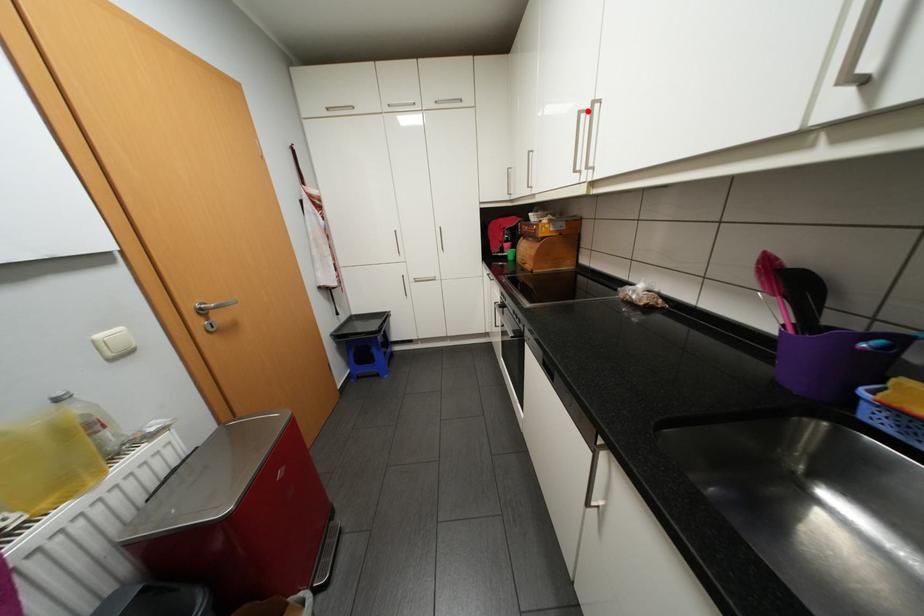
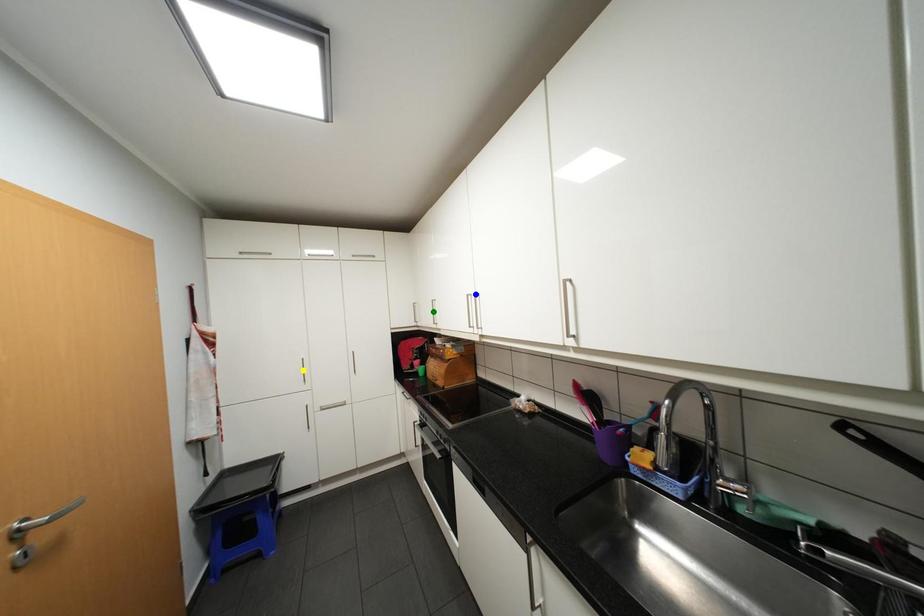
Question: I am providing you with two images of the same scene from different viewpoints. A red point is marked on the first image. You are given multiple points on the second image. Which point in image 2 is actually the same real-world point as the red point in image 1?

Choices:
 (A) yellow point
 (B) green point
 (C) blue point

Answer: (C)